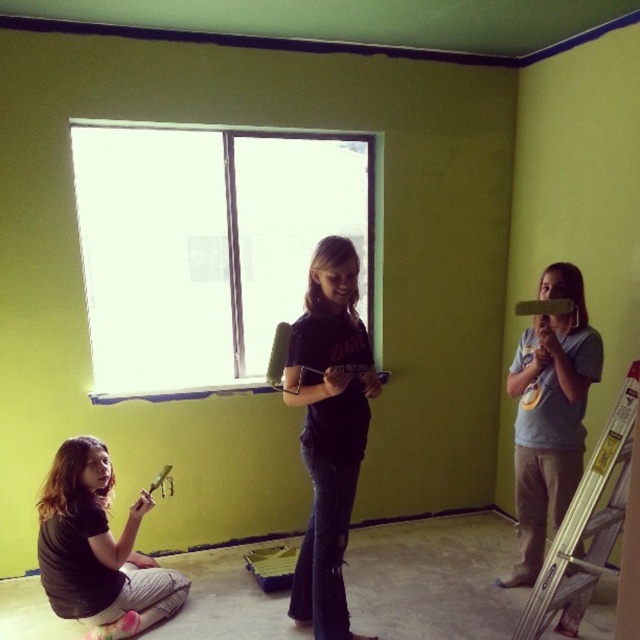
Question: Which object appears farthest from the camera in this image?

Choices:
 (A) black matte shirt at center
 (B) silver metallic ladder at right
 (C) transparent glass window at center

Answer: (C)

Question: Which object is the farthest from the black matte shirt at center?

Choices:
 (A) silver metallic ladder at right
 (B) matte green paintbrush at upper right
 (C) transparent glass window at center

Answer: (C)

Question: Is transparent glass window at center bigger than matte black shirt at lower left?

Choices:
 (A) yes
 (B) no

Answer: (A)

Question: Is matte black shirt at lower left smaller than matte green paintbrush at upper right?

Choices:
 (A) yes
 (B) no

Answer: (B)

Question: Can you confirm if black matte shirt at center is thinner than matte green paintbrush at upper right?

Choices:
 (A) no
 (B) yes

Answer: (A)

Question: Which of the following is the farthest from the observer?

Choices:
 (A) transparent glass window at center
 (B) matte green paintbrush at lower left
 (C) silver metallic ladder at right
 (D) matte black shirt at lower left

Answer: (A)